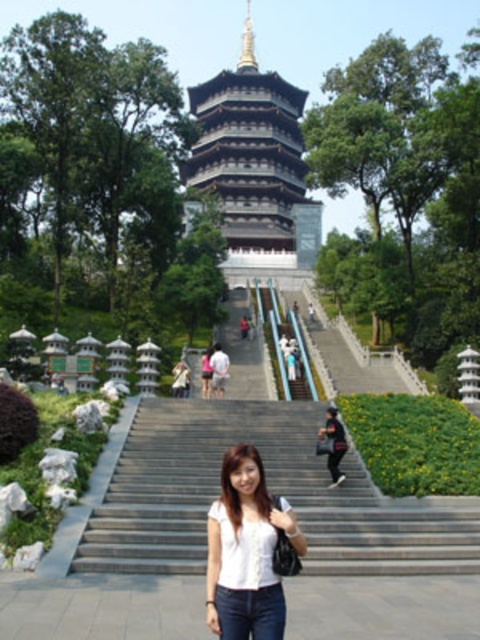
You are standing at the base of the pagoda and want to take a photo of the golden spire at the top. The camera you are using has a focal length of 50mm. Given that the point corresponding to the golden spire is located at point (219, 637), which is 19.47 meters away from you, will the golden spire appear in the center of your photo?

The golden spire at the top of the pagoda is located at point (219, 637), which is 19.47 meters away from the camera. Since the point is specified as the location of the golden spire, it will be centered in the photo if the camera is aimed directly at that point. However, the question does not provide information about the camera angle or field of view, so we cannot definitively confirm if the golden spire will be centered. The distance alone does not determine the framing.

You are a tailor observing two shirts displayed on mannequins in front of the pagoda. The shirts are the white matte shirt at center and the matte black shirt at center. Which shirt has a narrower silhouette?

The white matte shirt at center is thinner than the matte black shirt at center, so the white matte shirt at center has a narrower silhouette.

You are planning to walk up the stairs to the pagoda. Considering the width of the gray concrete stairs at center and the white stone pagoda at center, do you think the stairs are narrow enough to allow a person to walk up comfortably?

The gray concrete stairs at center are narrower than the white stone pagoda at center, so they may be narrow for comfortable walking, but since stairs are typically designed for passage, they should still be usable.